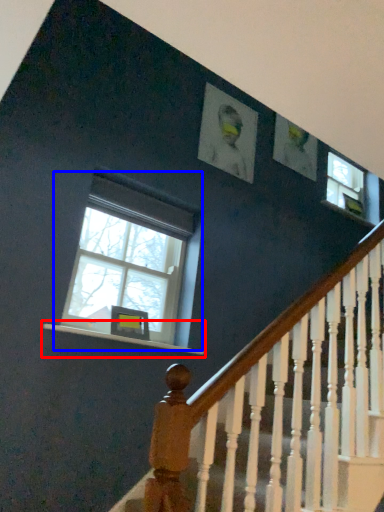
Question: Which of the following is the farthest to the observer, window sill (highlighted by a red box) or window (highlighted by a blue box)?

Choices:
 (A) window sill
 (B) window

Answer: (B)